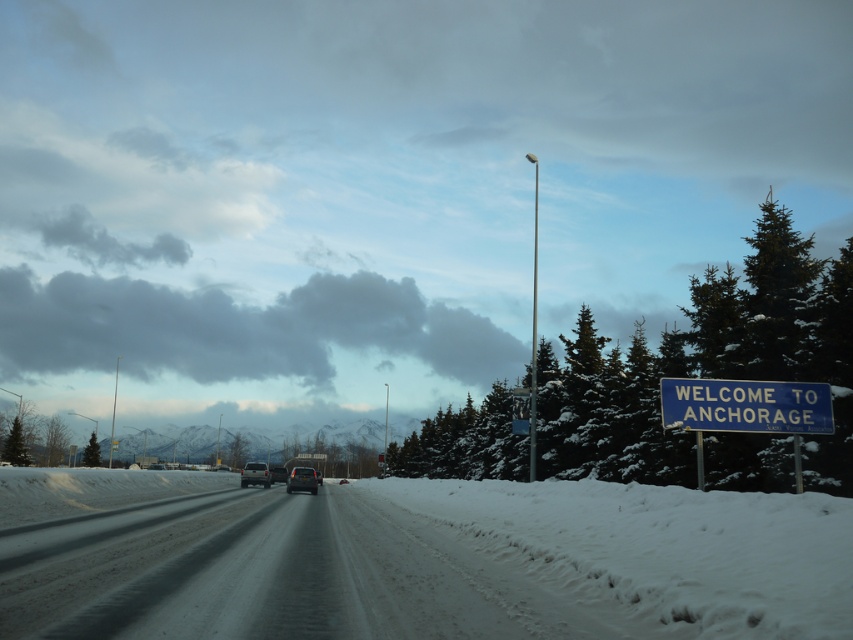
Between snow-covered evergreen at right and metallic silver sedan at center, which one has less height?

metallic silver sedan at center

Is point (839, 392) in front of point (311, 483)?

Yes, point (839, 392) is closer to viewer.

At what (x,y) coordinates should I click in order to perform the action: click on snow-covered evergreen at right. Please return your answer as a coordinate pair (x, y). Looking at the image, I should click on [705, 365].

This screenshot has width=853, height=640. Identify the location of dark gray fluffy cloud at upper center. (238, 330).

Is dark gray fluffy cloud at upper center wider than satin silver sedan at center?

Yes.

Does point (93, 342) come closer to viewer compared to point (257, 461)?

No, (93, 342) is further to viewer.

Identify the location of dark gray fluffy cloud at upper center. (238, 330).

Which is more to the left, white fluffy snow at right or matte black suv at center?

From the viewer's perspective, matte black suv at center appears more on the left side.

Which is above, white fluffy snow at right or matte black suv at center?

Positioned higher is white fluffy snow at right.

Describe the element at coordinates (659, 550) in the screenshot. I see `white fluffy snow at right` at that location.

Find the location of `white fluffy snow at right`. white fluffy snow at right is located at coordinates (659, 550).